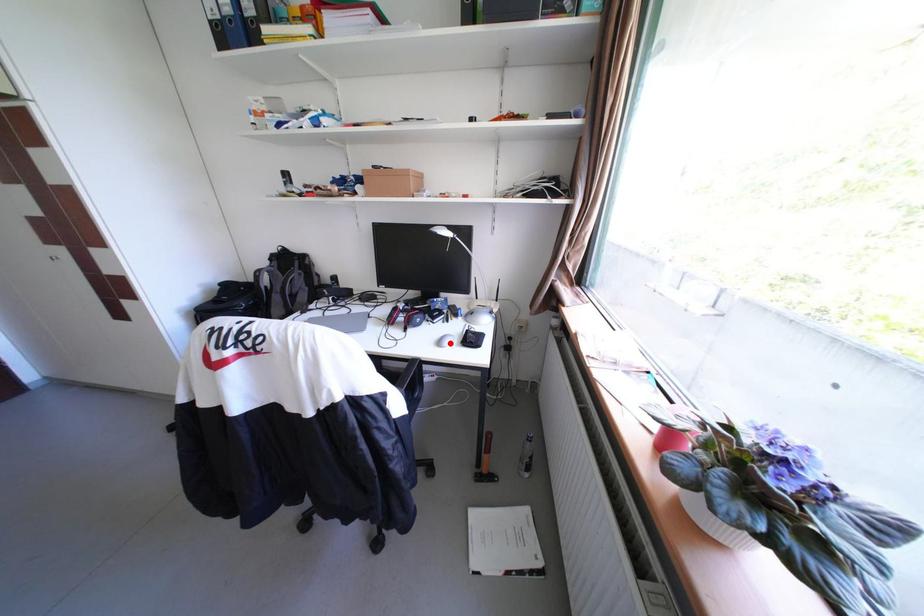
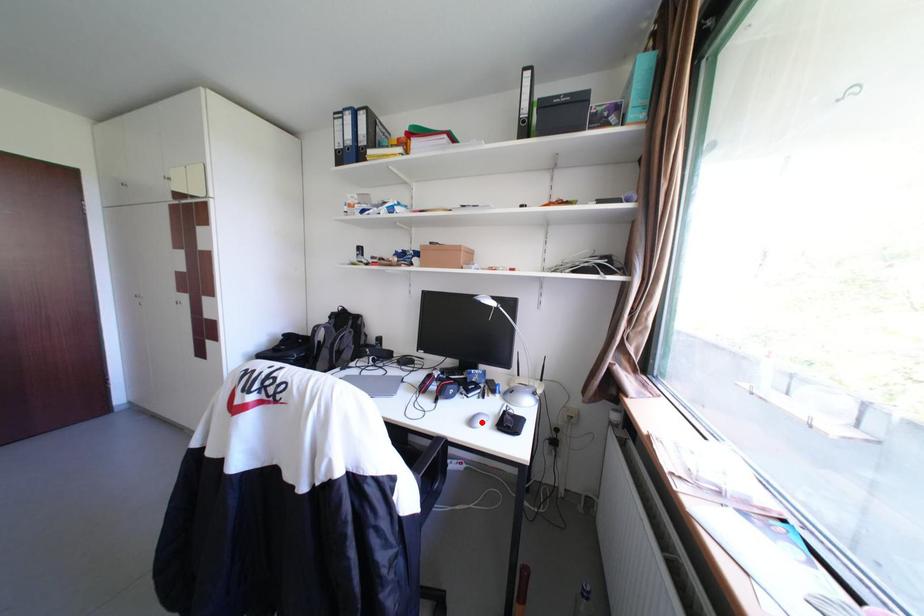
I am providing you with two images of the same scene from different viewpoints. A red point is marked on the first image and another point is marked on the second image. Does the point marked in image1 correspond to the same location as the one in image2?

Yes